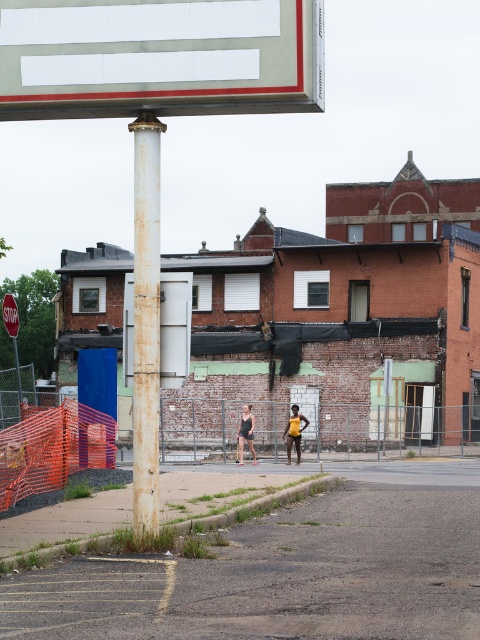
Question: Which point is closer to the camera?

Choices:
 (A) (457, 513)
 (B) (305, 420)
 (C) (254, 456)

Answer: (A)

Question: Based on their relative distances, which object is nearer to the smooth asphalt court at center?

Choices:
 (A) yellow matte shorts at center
 (B) rusty metal pole at center

Answer: (B)

Question: Where is smooth asphalt court at center located in relation to matte black tank top at center in the image?

Choices:
 (A) left
 (B) right

Answer: (B)

Question: Which of the following is the farthest from the observer?

Choices:
 (A) rusty metal pole at center
 (B) smooth asphalt court at center
 (C) matte black tank top at center

Answer: (C)

Question: Is rusty metal pole at center positioned in front of matte black tank top at center?

Choices:
 (A) yes
 (B) no

Answer: (A)

Question: Is smooth asphalt court at center positioned at the back of yellow matte shorts at center?

Choices:
 (A) yes
 (B) no

Answer: (B)